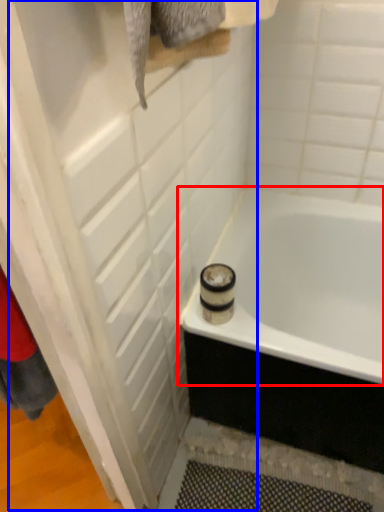
Question: Which of the following is the closest to the observer, bathtub (highlighted by a red box) or screen door (highlighted by a blue box)?

Choices:
 (A) bathtub
 (B) screen door

Answer: (B)